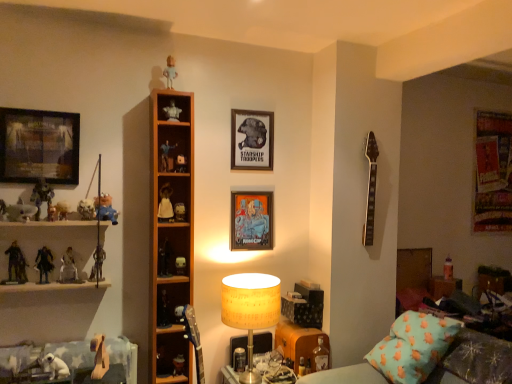
Find the location of a particular element. This screenshot has height=384, width=512. blank space above wooden at lower center, the first shelf positioned from the right (from a real-world perspective) is located at coordinates (x=302, y=324).